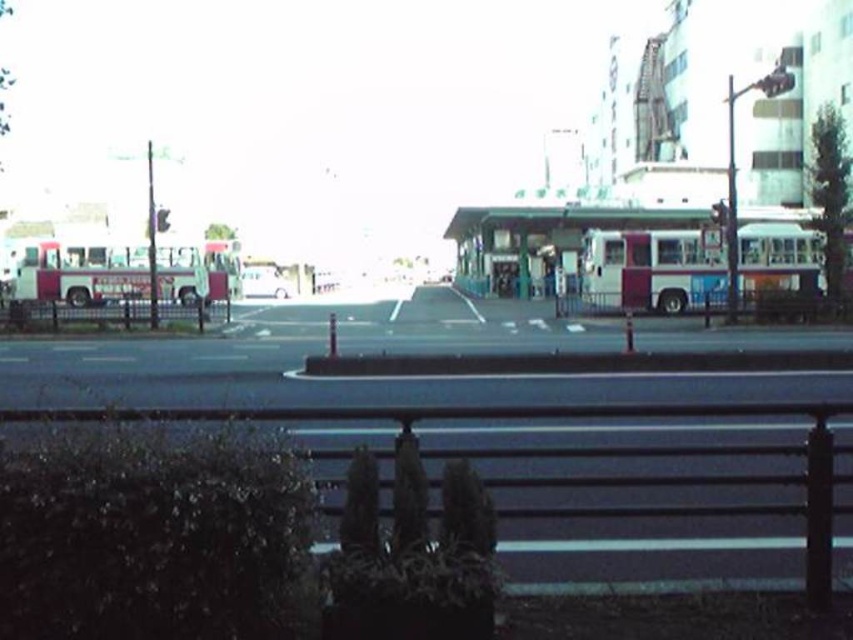
From the picture: You are a pedestrian looking at the street scene. You notice a metallic traffic light at upper right and a metallic pole at upper left. Which object is positioned higher in the image?

The metallic traffic light at upper right is positioned higher than the metallic pole at upper left in the image.